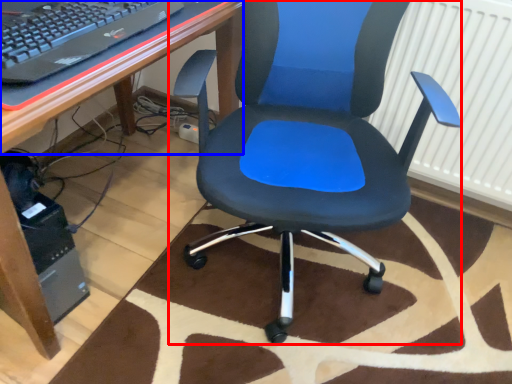
Question: Which object is further to the camera taking this photo, chair (highlighted by a red box) or computer desk (highlighted by a blue box)?

Choices:
 (A) chair
 (B) computer desk

Answer: (B)